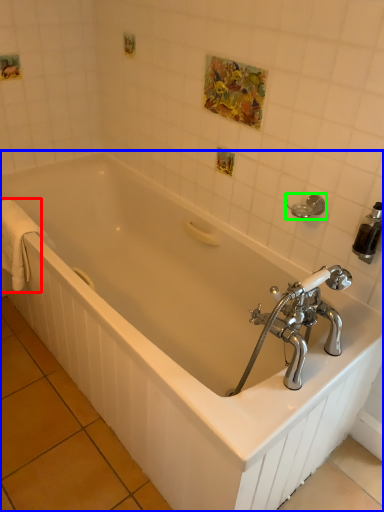
Question: Which object is the closest to the bath towel (highlighted by a red box)? Choose among these: bathtub (highlighted by a blue box) or towel bar (highlighted by a green box).

Choices:
 (A) bathtub
 (B) towel bar

Answer: (A)